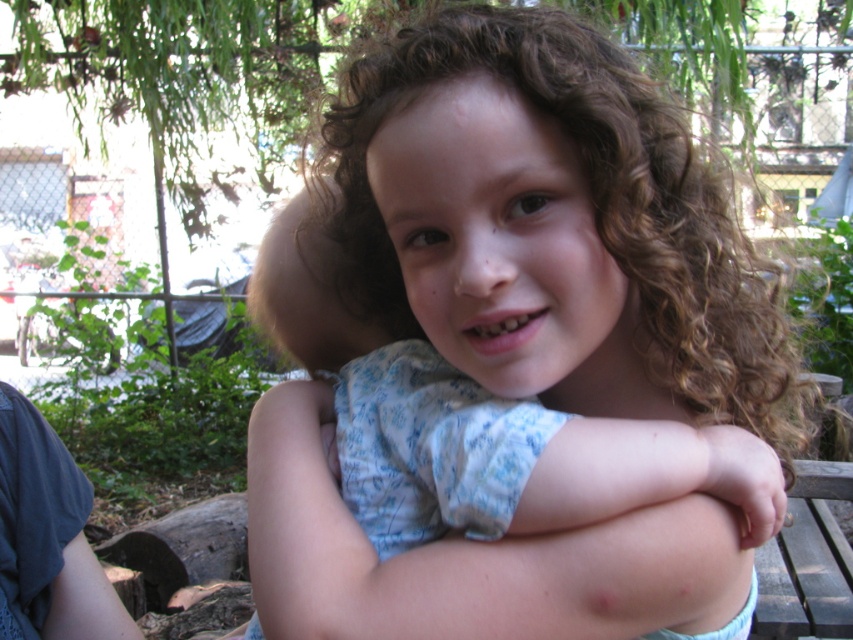
You are a photographer standing in a garden. You want to take a closeup shot of the curly brown hair at center without moving the child. Can you move closer to the child to achieve this? The camera you are using has a minimum focusing distance of 40 centimeters.

The distance between you and the curly brown hair at center is 45.68 centimeters. Since your camera can focus as close as 40 centimeters, you can move 5.68 centimeters closer to the child to take the closeup shot.

You are taking a photo of the child and want to focus on both the point at the top of their head and the point on their left hand. The points are labeled as point 1 at coordinates point (461, 36) and point 2 at coordinates point (310, 321). Which point is closer to the camera?

Point (461, 36) is closer to the camera than point (310, 321).